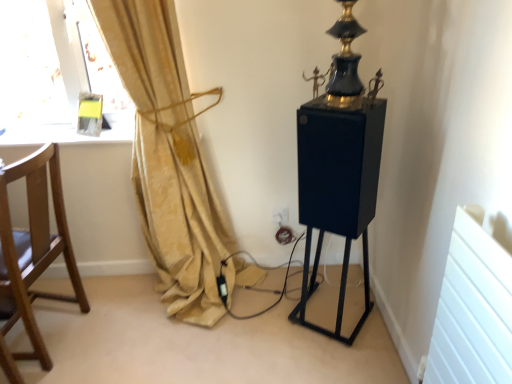
Question: Is wooden chair at left to the left or to the right of white plastic electric outlet at center in the image?

Choices:
 (A) right
 (B) left

Answer: (B)

Question: Is wooden chair at left in front of or behind white plastic electric outlet at center in the image?

Choices:
 (A) behind
 (B) front

Answer: (B)

Question: Which object is the farthest from the wooden chair at left?

Choices:
 (A) gold fabric curtain at left
 (B) white plastic electric outlet at center
 (C) matte glass window sill at upper left

Answer: (B)

Question: Which object is positioned farthest from the wooden chair at left?

Choices:
 (A) gold fabric curtain at left
 (B) matte glass window sill at upper left
 (C) white plastic electric outlet at center

Answer: (C)